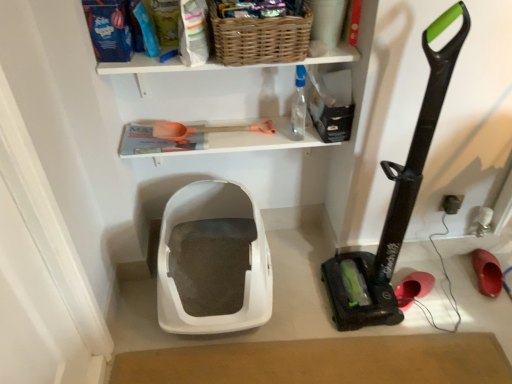
At what (x,y) coordinates should I click in order to perform the action: click on free space that is in between black plastic vacuum cleaner at right and rubberized red shoe at lower right, the second footwear from the right. Please return your answer as a coordinate pair (x, y). The width and height of the screenshot is (512, 384). Looking at the image, I should click on [408, 285].